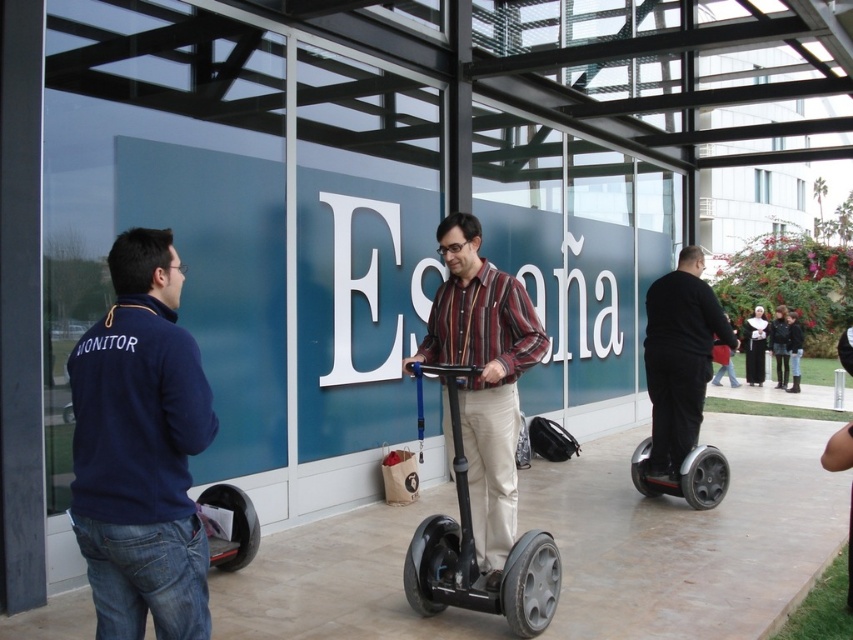
Question: Can you confirm if dark blue fleece at left is smaller than black matte segway at right?

Choices:
 (A) yes
 (B) no

Answer: (A)

Question: Is black rubber scooter at right wider than dark brown nun's habit at right?

Choices:
 (A) yes
 (B) no

Answer: (B)

Question: Is dark blue fleece at left above black rubber scooter at center?

Choices:
 (A) no
 (B) yes

Answer: (B)

Question: Which point appears farthest from the camera in this image?

Choices:
 (A) (520, 586)
 (B) (712, 477)
 (C) (775, 312)
 (D) (763, 360)

Answer: (C)

Question: Which point is closer to the camera?

Choices:
 (A) (637, 484)
 (B) (445, 540)
 (C) (788, 337)
 (D) (682, 385)

Answer: (B)

Question: Which object is the closest to the dark brown nun's habit at right?

Choices:
 (A) dark brown leather jacket at center
 (B) black rubber scooter at right
 (C) dark blue fleece at left
 (D) black matte segway at right

Answer: (A)